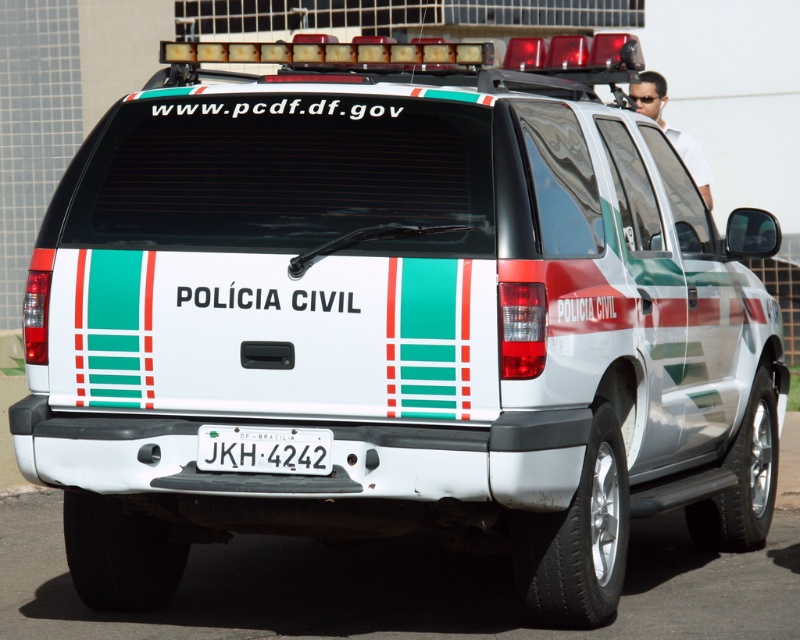
You are a traffic officer observing a police vehicle from behind. You notice a white plastic license plate at center and a white shirt at upper right. Which object takes up more area on the vehicle?

The white shirt at upper right takes up more area than the white plastic license plate at center.

You are a traffic officer observing a vehicle from behind. You notice a white plastic license plate at center and a white shirt at upper right. Which object is closer to the top edge of the vehicle?

The white shirt at upper right is closer to the top edge of the vehicle since it is positioned above the white plastic license plate at center.